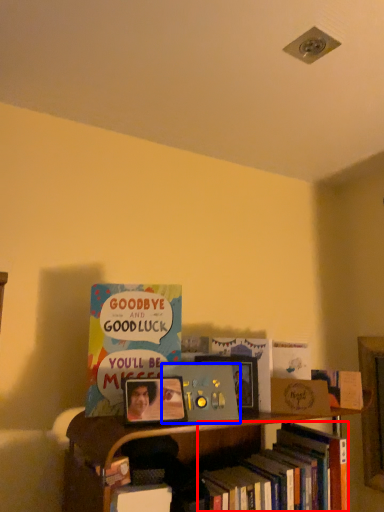
Question: Which of the following is the closest to the observer, book (highlighted by a red box) or book (highlighted by a blue box)?

Choices:
 (A) book
 (B) book

Answer: (A)